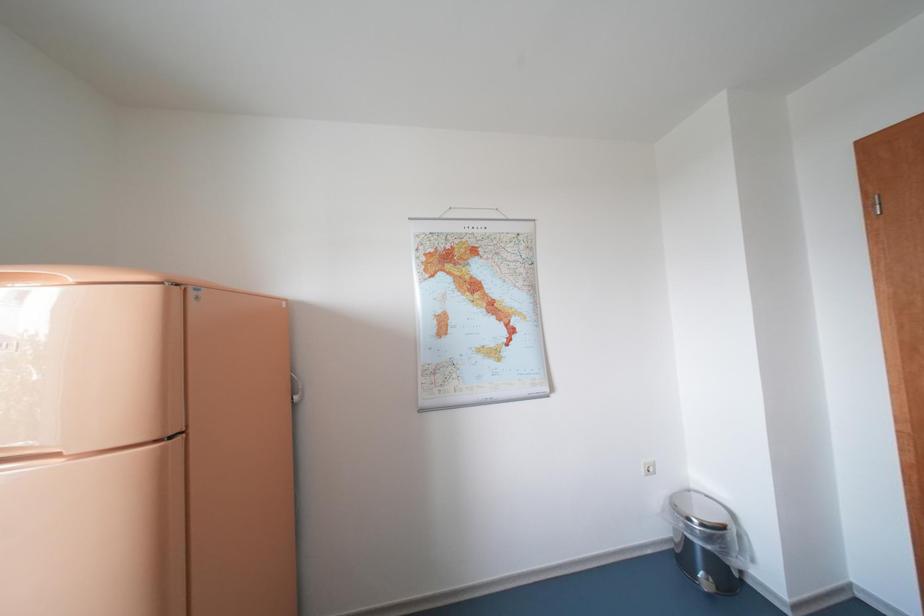
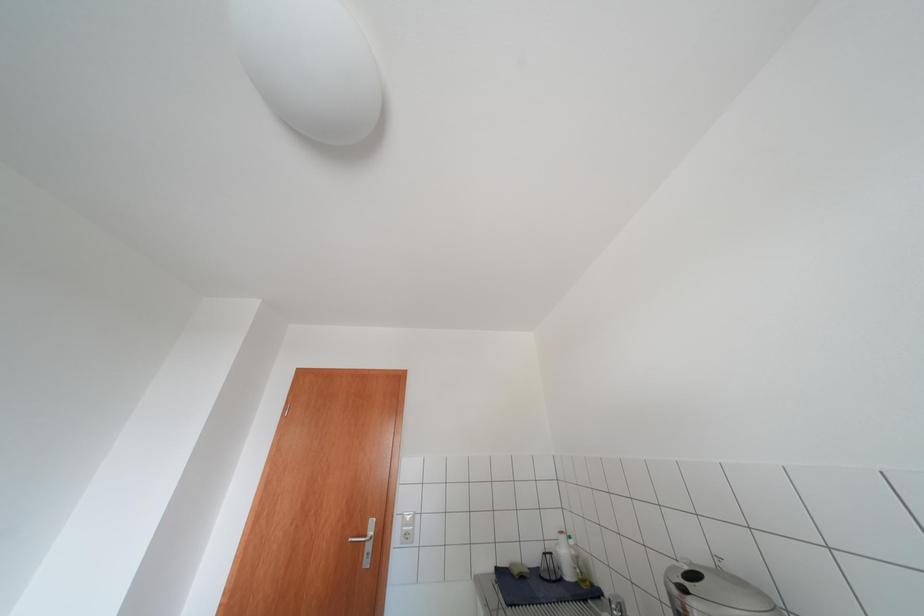
First-person continuous shooting, in which direction is the camera rotating?

The camera rotated toward right-up.